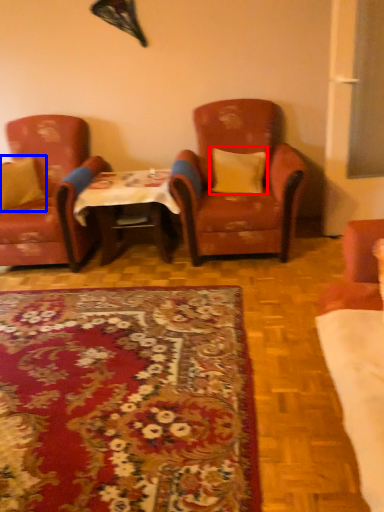
Question: Which point is further to the camera, pillow (highlighted by a red box) or pillow (highlighted by a blue box)?

Choices:
 (A) pillow
 (B) pillow

Answer: (B)